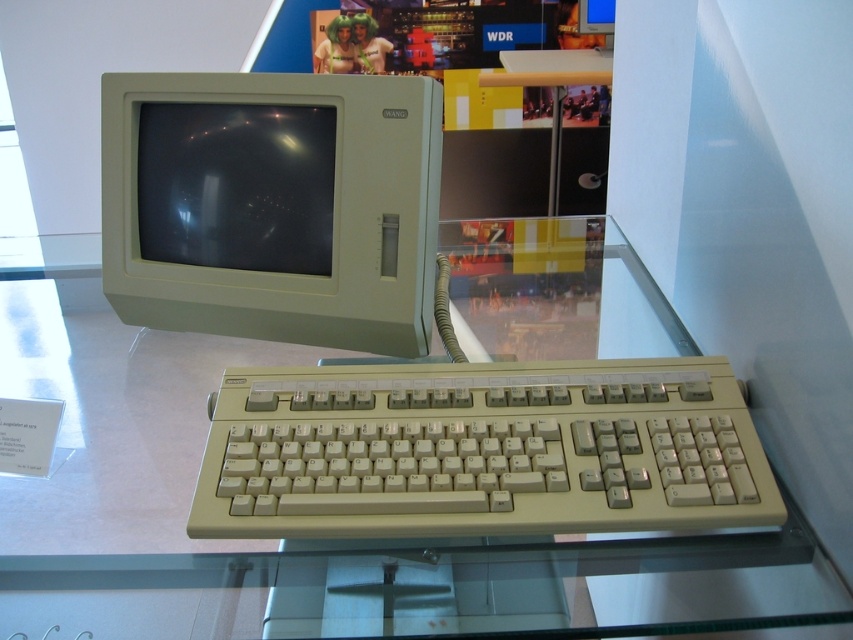
Image resolution: width=853 pixels, height=640 pixels. Describe the element at coordinates (294, 548) in the screenshot. I see `clear glass table at center` at that location.

Consider the image. Does clear glass table at center appear under beige plastic keyboard at center?

Incorrect, clear glass table at center is not positioned below beige plastic keyboard at center.

Between point (514, 612) and point (505, 518), which one is positioned behind?

Positioned behind is point (505, 518).

Identify the location of clear glass table at center. Image resolution: width=853 pixels, height=640 pixels. (294, 548).

Is beige plastic monitor at upper left shorter than matte plastic monitor at upper left?

No, beige plastic monitor at upper left is not shorter than matte plastic monitor at upper left.

At what (x,y) coordinates should I click in order to perform the action: click on beige plastic monitor at upper left. Please return your answer as a coordinate pair (x, y). This screenshot has height=640, width=853. Looking at the image, I should click on (271, 205).

Does point (694, 380) come behind point (228, 182)?

No, it is not.

Is beige plastic keyboard at center to the right of matte plastic monitor at upper left from the viewer's perspective?

Yes, beige plastic keyboard at center is to the right of matte plastic monitor at upper left.

Which is behind, point (614, 454) or point (323, 252)?

Point (323, 252)

The width and height of the screenshot is (853, 640). Find the location of `beige plastic keyboard at center`. beige plastic keyboard at center is located at coordinates pyautogui.click(x=480, y=451).